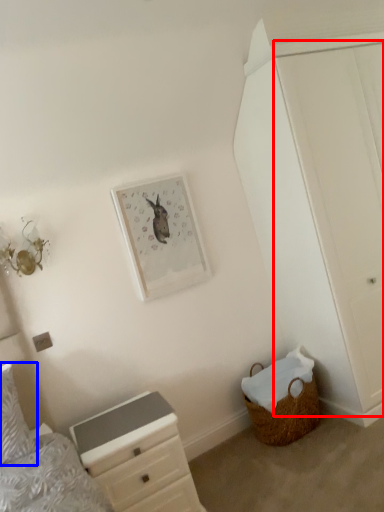
Question: Which object is further to the camera taking this photo, door (highlighted by a red box) or pillow (highlighted by a blue box)?

Choices:
 (A) door
 (B) pillow

Answer: (A)